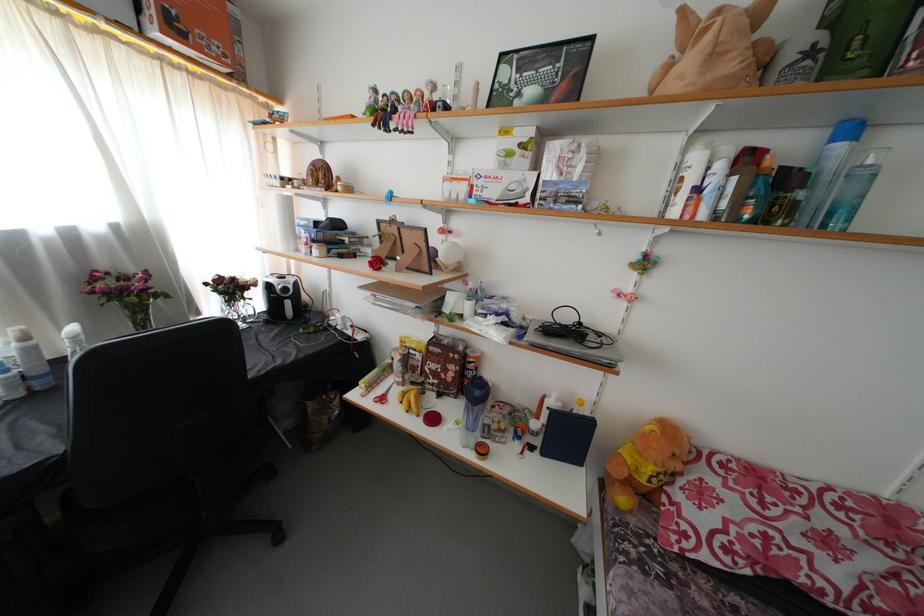
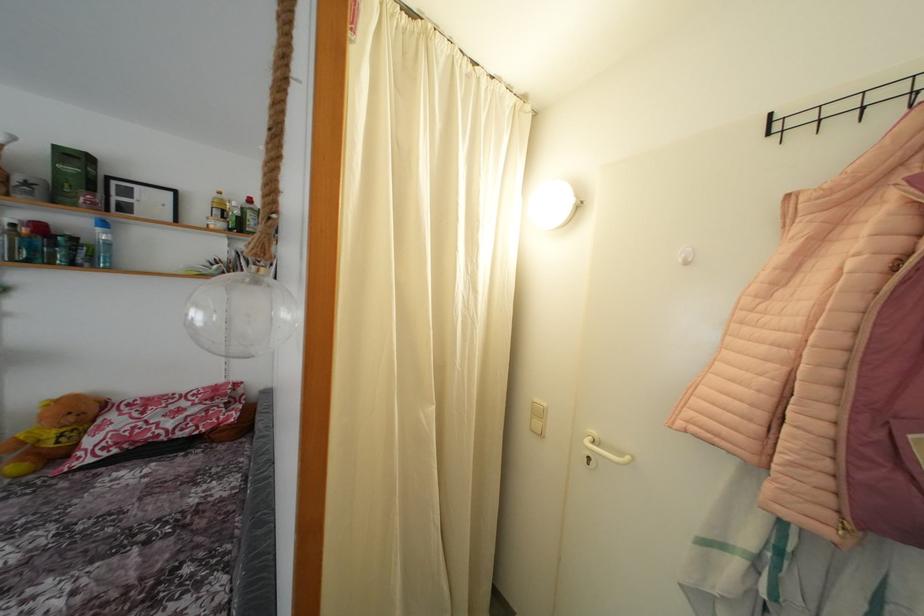
Where in the second image is the point corresponding to [845,153] from the first image?

(104, 236)